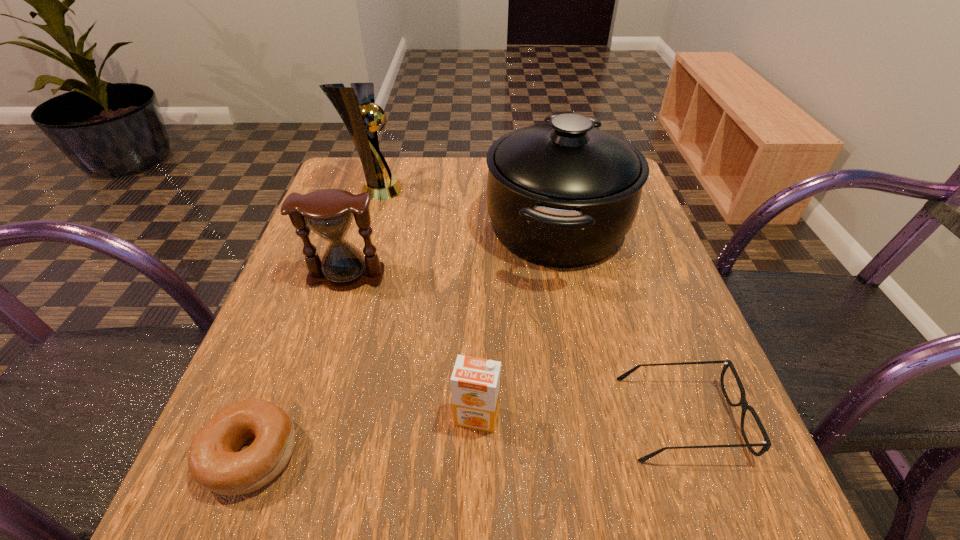
You are a GUI agent. You are given a task and a screenshot of the screen. Output one action in this format:
    pyautogui.click(x=<x>, y=<y>)
    Task: Click on the bagel that is at the left edge
    The image size is (960, 540).
    Given the screenshot: What is the action you would take?
    tap(214, 462)

Identify the location of saucepan that is positioned at the right edge. The width and height of the screenshot is (960, 540). (563, 195).

The width and height of the screenshot is (960, 540). Identify the location of spectacles situated at the right edge. (766, 444).

In order to click on object that is at the far left corner in this screenshot , I will do `click(356, 106)`.

Where is `object present at the near left corner`? Image resolution: width=960 pixels, height=540 pixels. object present at the near left corner is located at coordinates (214, 462).

Identify the location of object present at the far right corner. (563, 195).

You are a GUI agent. You are given a task and a screenshot of the screen. Output one action in this format:
    pyautogui.click(x=<x>, y=<y>)
    Task: Click on the object located at the near right corner
    This screenshot has width=960, height=540.
    Given the screenshot: What is the action you would take?
    pyautogui.click(x=766, y=444)

Locate an element on the screen. This screenshot has height=540, width=960. free spot at the far edge of the desktop is located at coordinates (468, 195).

At what (x,y) coordinates should I click in order to perform the action: click on vacant area at the near edge. Please return your answer as a coordinate pair (x, y). The image size is (960, 540). Looking at the image, I should click on (494, 491).

Identify the location of vacant space at the left edge of the desktop. This screenshot has height=540, width=960. (267, 346).